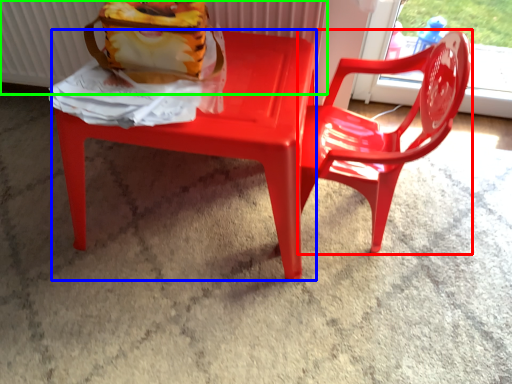
Question: Estimate the real-world distances between objects in this image. Which object is closer to chair (highlighted by a red box), chair (highlighted by a blue box) or radiator (highlighted by a green box)?

Choices:
 (A) chair
 (B) radiator

Answer: (A)